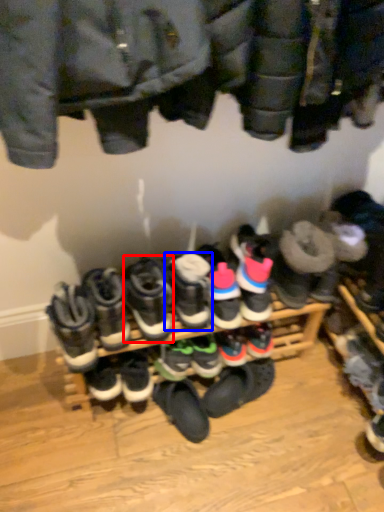
Question: Which object is further to the camera taking this photo, footwear (highlighted by a red box) or footwear (highlighted by a blue box)?

Choices:
 (A) footwear
 (B) footwear

Answer: (B)